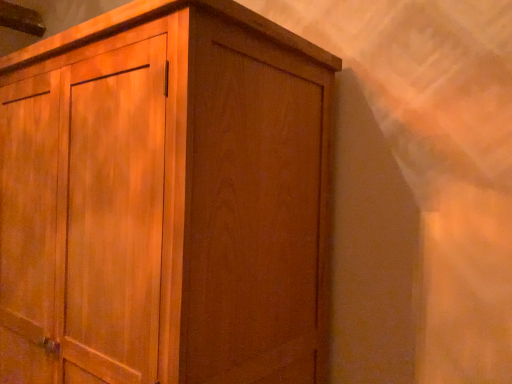
Describe the element at coordinates (166, 201) in the screenshot. I see `matte wood cupboard at center` at that location.

Measure the distance between point [264,304] and camera.

They are 38.90 inches apart.

You are a GUI agent. You are given a task and a screenshot of the screen. Output one action in this format:
    pyautogui.click(x=<x>, y=<y>)
    Task: Click on the matte wood cupboard at center
    This screenshot has height=384, width=512.
    Given the screenshot: What is the action you would take?
    pyautogui.click(x=166, y=201)

Find the location of a particular element. matte wood cupboard at center is located at coordinates (166, 201).